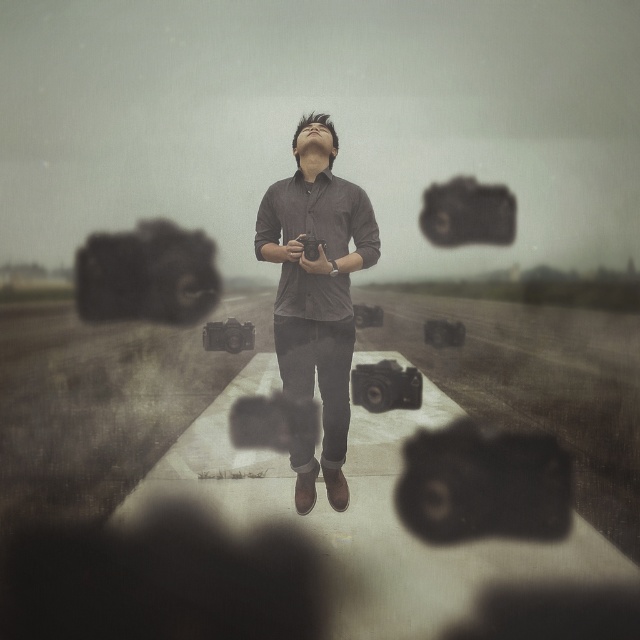
Is matte gray shirt at center to the left of matte black camera at upper center from the viewer's perspective?

Correct, you'll find matte gray shirt at center to the left of matte black camera at upper center.

Is matte gray shirt at center positioned behind matte black camera at upper center?

Yes, it is behind matte black camera at upper center.

Is point (344, 214) farther from camera compared to point (470, 241)?

Yes, it is.

Where is `matte gray shirt at center`? This screenshot has width=640, height=640. matte gray shirt at center is located at coordinates (316, 292).